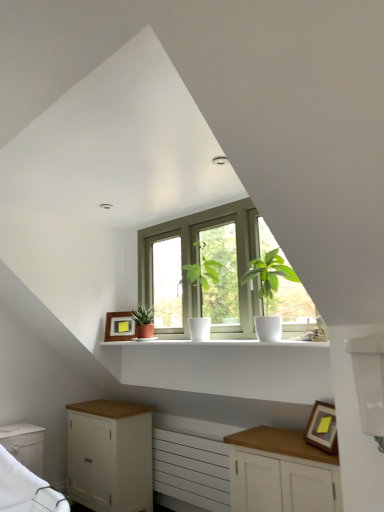
Find the location of a particular element. The height and width of the screenshot is (512, 384). vacant area on top of white matte radiator at lower center (from a real-world perspective) is located at coordinates (188, 432).